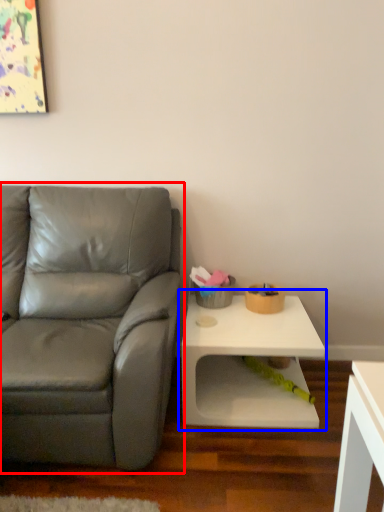
Question: Which object appears closest to the camera in this image, studio couch (highlighted by a red box) or table (highlighted by a blue box)?

Choices:
 (A) studio couch
 (B) table

Answer: (A)